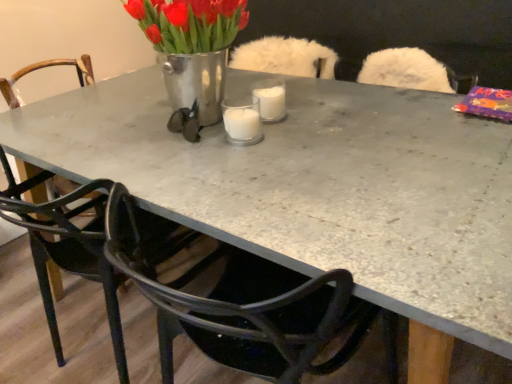
Locate an element on the screen. The height and width of the screenshot is (384, 512). free point in front of clear glass candle at center is located at coordinates (248, 161).